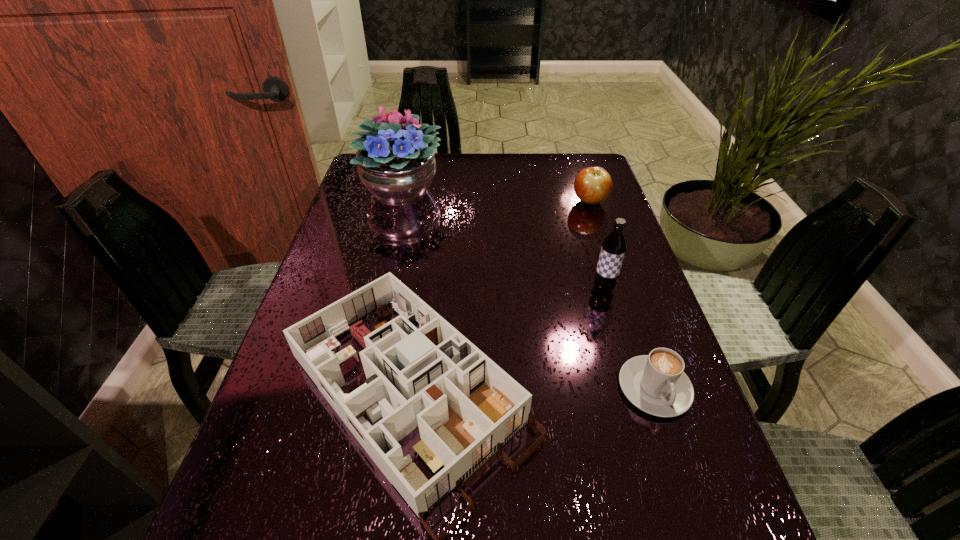
I want to click on empty location between the cappuccino and the apple, so click(x=622, y=295).

Locate an element on the screen. This screenshot has height=540, width=960. vacant area that lies between the apple and the third farthest object is located at coordinates (596, 245).

Identify the location of the second closest object to the apple. This screenshot has width=960, height=540. (396, 162).

Where is `object that ranks as the second closest to the dollhouse`? This screenshot has width=960, height=540. object that ranks as the second closest to the dollhouse is located at coordinates 656,383.

Find the location of a particular element. vacant area that satisfies the following two spatial constraints: 1. on the back side of the third farthest object; 2. on the right side of the apple is located at coordinates (578, 201).